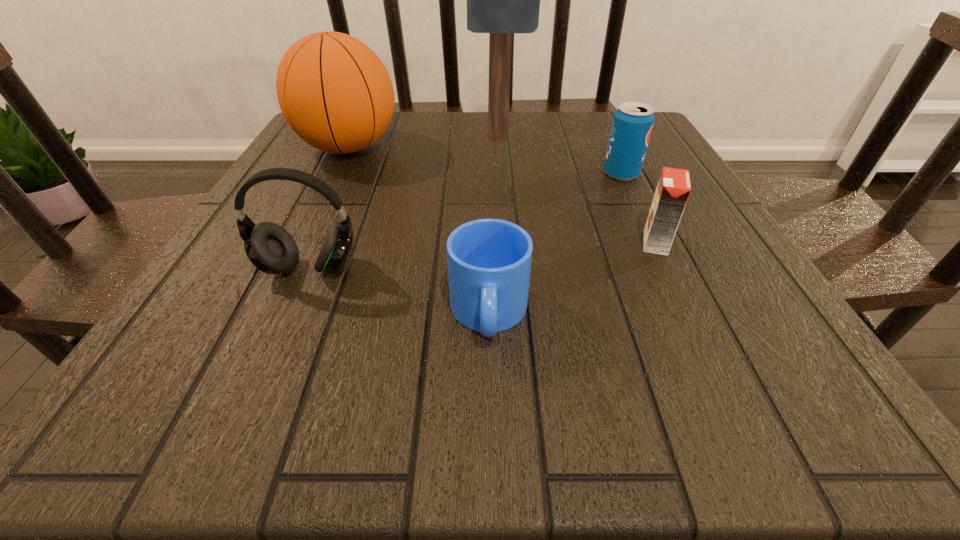
What are the coordinates of `free spot located on the back of the orange juice` in the screenshot? It's located at (603, 134).

At what (x,y) coordinates should I click in order to perform the action: click on mallet situated at the far edge. Please return your answer as a coordinate pair (x, y). Looking at the image, I should click on [x=501, y=0].

Find the location of `basketball located in the far edge section of the desktop`. basketball located in the far edge section of the desktop is located at coordinates (334, 91).

The height and width of the screenshot is (540, 960). Identify the location of basketball present at the left edge. (334, 91).

Locate an element on the screen. This screenshot has height=540, width=960. headset that is positioned at the left edge is located at coordinates (270, 248).

I want to click on soda can that is at the right edge, so click(632, 125).

The width and height of the screenshot is (960, 540). I want to click on orange juice that is at the right edge, so click(673, 189).

Locate an element on the screen. The image size is (960, 540). object that is at the far left corner is located at coordinates (334, 91).

In the image, there is a desktop. Where is `free space at the far edge`? This screenshot has height=540, width=960. free space at the far edge is located at coordinates (497, 145).

The height and width of the screenshot is (540, 960). I want to click on free space at the near edge of the desktop, so click(659, 395).